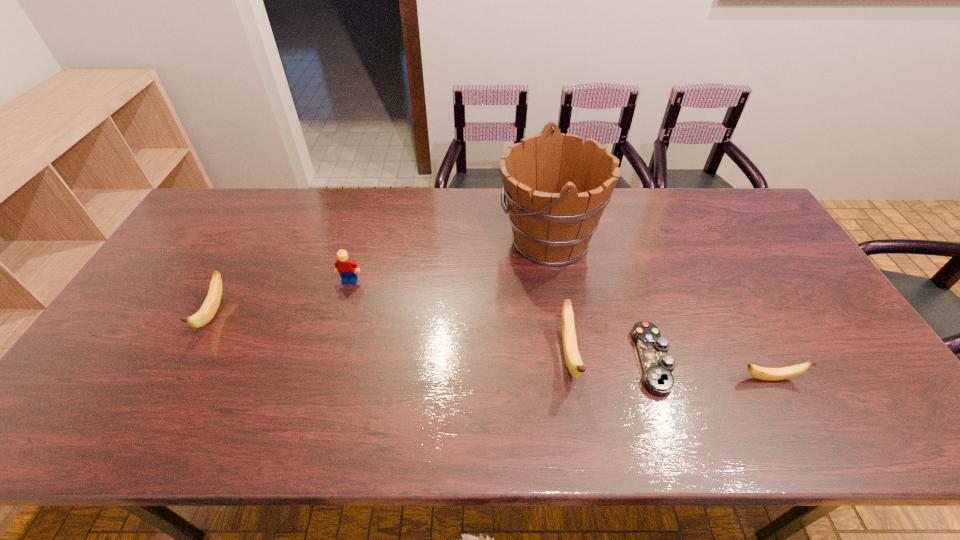
Find the location of `free location at the left edge of the desktop`. free location at the left edge of the desktop is located at coordinates (183, 237).

Where is `vacant space at the right edge of the desktop`? The width and height of the screenshot is (960, 540). vacant space at the right edge of the desktop is located at coordinates (780, 266).

Identify the location of free space at the far left corner of the desktop. Image resolution: width=960 pixels, height=540 pixels. (246, 216).

Where is `vacant space at the far right corner of the desktop`? vacant space at the far right corner of the desktop is located at coordinates (734, 225).

Where is `vacant point located between the control and the tallest banana`? This screenshot has width=960, height=540. vacant point located between the control and the tallest banana is located at coordinates (611, 357).

This screenshot has width=960, height=540. Identify the location of vacant area between the fifth tallest object and the third shortest object. (492, 346).

What are the coordinates of `vacant space in between the fourth tallest object and the rightmost object` in the screenshot? It's located at (492, 346).

Where is `vacant region between the tallest object and the leftmost banana`? The image size is (960, 540). vacant region between the tallest object and the leftmost banana is located at coordinates (381, 276).

This screenshot has width=960, height=540. I want to click on free space between the rightmost object and the tallest object, so click(659, 309).

Where is `vacant point located between the tallest object and the second banana from right to left`? The width and height of the screenshot is (960, 540). vacant point located between the tallest object and the second banana from right to left is located at coordinates (559, 298).